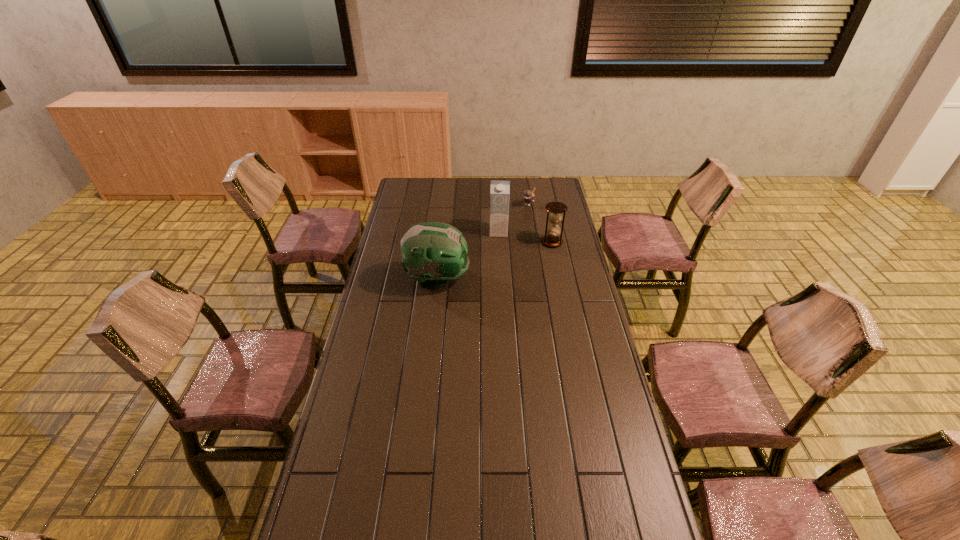
Find the location of a particular element. Image resolution: width=960 pixels, height=540 pixels. vacant area located on the front-facing side of the farthest object is located at coordinates (519, 219).

What are the coordinates of `blank area located 0.100m on the front label of the third object from right to left` in the screenshot? It's located at (498, 250).

Identify the location of vacant space located 0.190m on the front label of the third object from right to left. (498, 262).

I want to click on vacant region located on the front label of the third object from right to left, so click(x=498, y=285).

What are the coordinates of `object that is at the far edge` in the screenshot? It's located at (529, 196).

I want to click on object at the left edge, so click(432, 253).

I want to click on hourglass located at the right edge, so click(x=556, y=208).

In order to click on kitten present at the right edge in this screenshot , I will do `click(529, 196)`.

At what (x,y) coordinates should I click in order to perform the action: click on object at the far right corner. Please return your answer as a coordinate pair (x, y). Image resolution: width=960 pixels, height=540 pixels. Looking at the image, I should click on (529, 196).

The image size is (960, 540). Identify the location of free space at the far edge of the desktop. (519, 185).